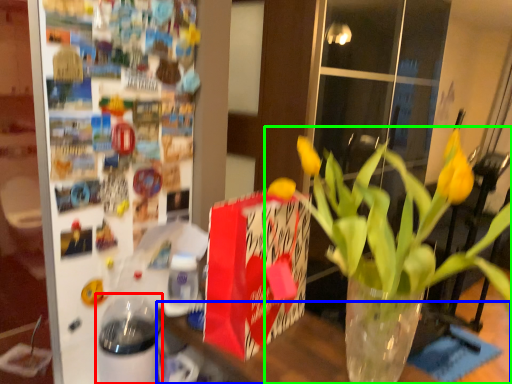
Question: Which is nearer to the glass jar (highlighted by a red box)? table (highlighted by a blue box) or houseplant (highlighted by a green box).

Choices:
 (A) table
 (B) houseplant

Answer: (B)